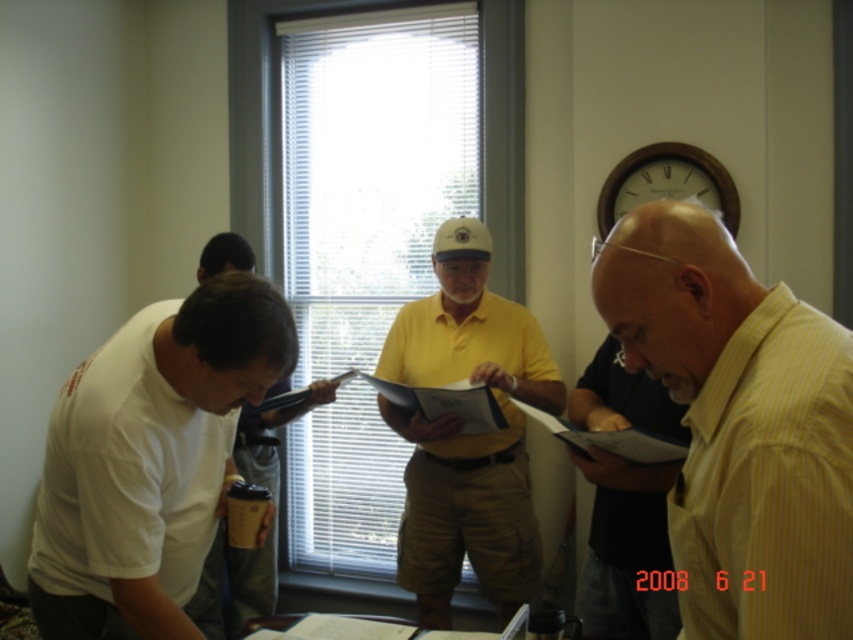
You are a photographer positioned at the camera. You want to take a closeup shot of the yellow striped shirt at right without moving the subject. Can you adjust your camera zoom to capture the shirt clearly?

The yellow striped shirt at right is 32.85 inches from camera, so adjusting the camera zoom to focus on the shirt at that distance should allow for a clear closeup shot without needing to move the subject.

You are an observer in the room. You see the yellow striped shirt at right and the white matte baseball hat at center. Which object is positioned lower in the scene?

The yellow striped shirt at right is located below the white matte baseball hat at center, so it is positioned lower in the scene.